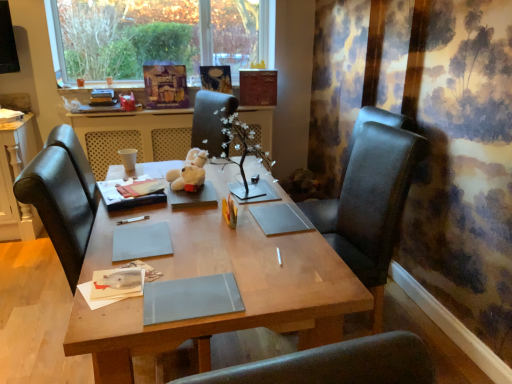
Where is `vacant space to the right of gray matte notebook at center, the second notebook when ordered from front to back`? vacant space to the right of gray matte notebook at center, the second notebook when ordered from front to back is located at coordinates (203, 240).